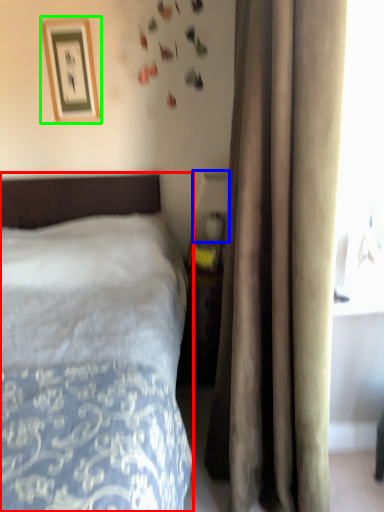
Question: Based on their relative distances, which object is farther from bed (highlighted by a red box)? Choose from table lamp (highlighted by a blue box) and picture frame (highlighted by a green box).

Choices:
 (A) table lamp
 (B) picture frame

Answer: (B)